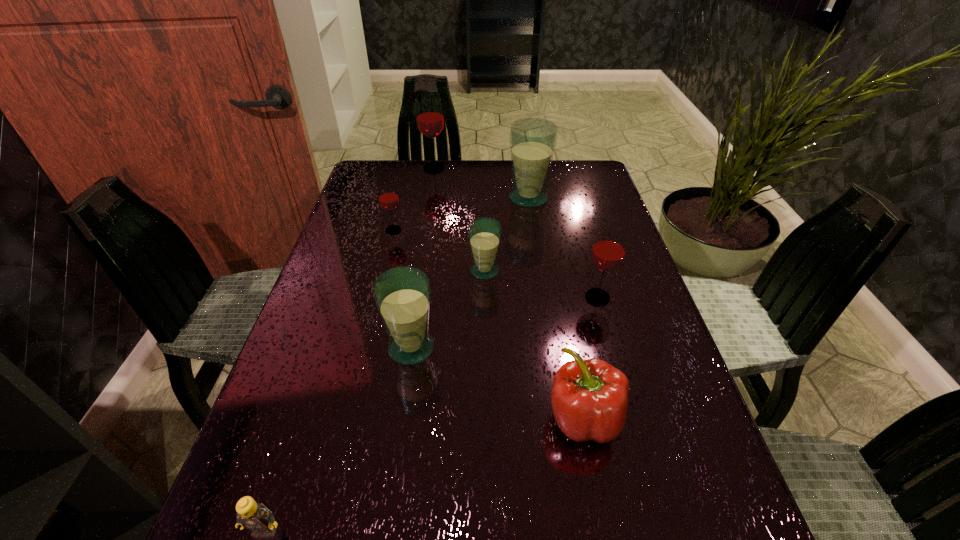
You are a GUI agent. You are given a task and a screenshot of the screen. Output one action in this format:
    pyautogui.click(x=<x>, y=<y>)
    Task: Click on the free region that satisfies the following two spatial constraints: 1. on the front side of the second biggest blue glass; 2. on the right side of the smallest red glass
    
    Given the screenshot: What is the action you would take?
    pyautogui.click(x=365, y=348)

Locate an element on the screen. vacant space that satisfies the following two spatial constraints: 1. on the front side of the farthest object; 2. on the left side of the biggest blue glass is located at coordinates (429, 198).